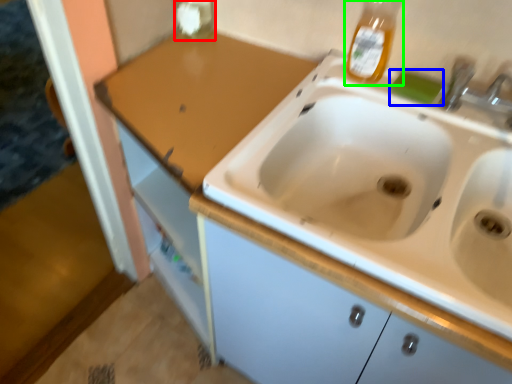
Question: Which is nearer to the bottle (highlighted by a red box)? soap (highlighted by a blue box) or bottle (highlighted by a green box).

Choices:
 (A) soap
 (B) bottle

Answer: (B)